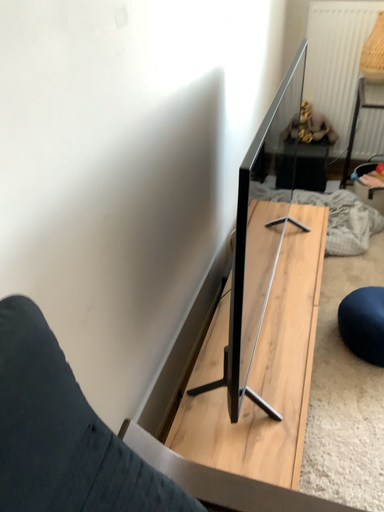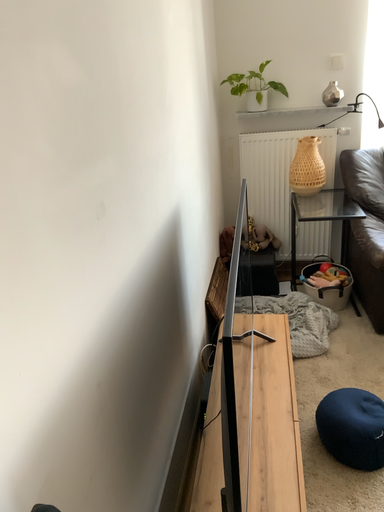
Question: How did the camera likely rotate when shooting the video?

Choices:
 (A) rotated downward
 (B) rotated upward

Answer: (B)